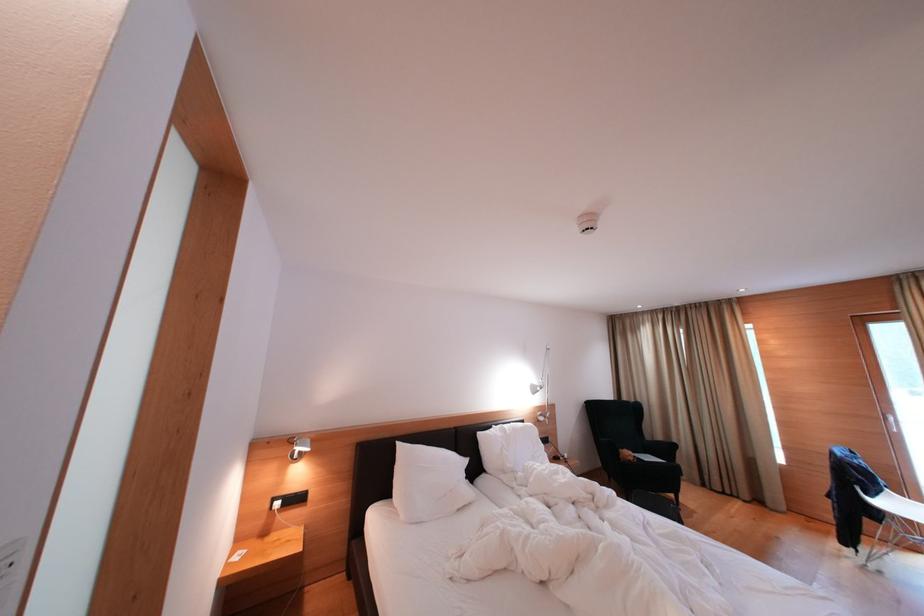
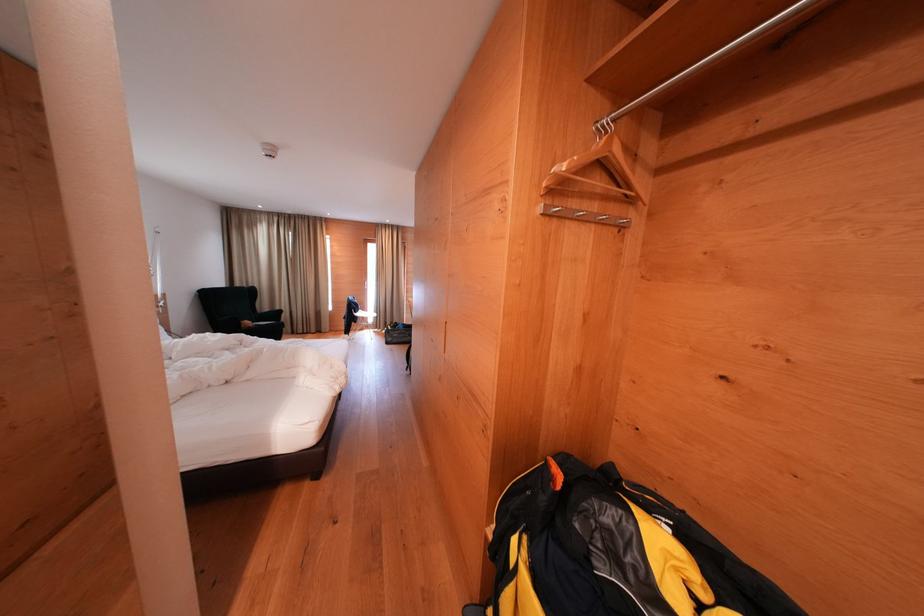
The point at (635, 458) is marked in the first image. Where is the corresponding point in the second image?

(254, 328)